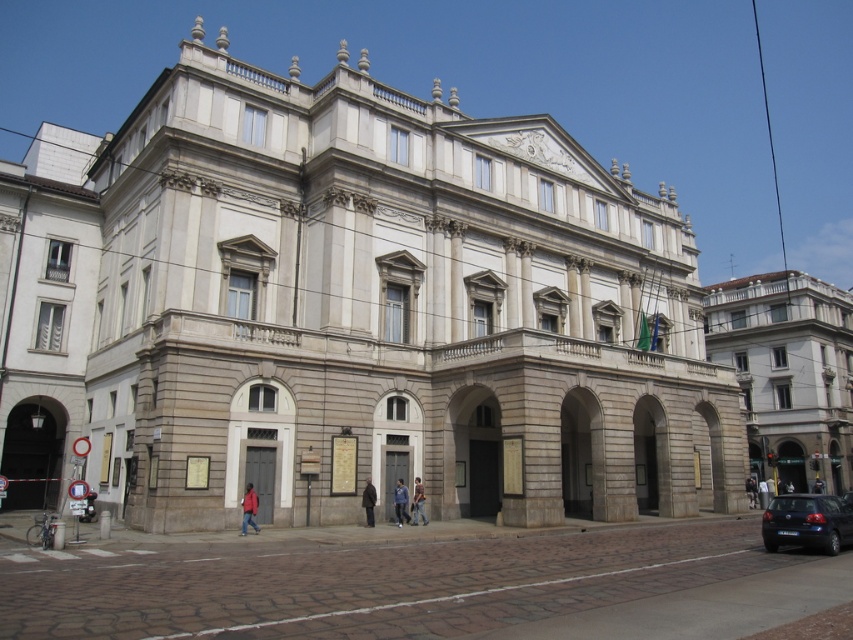
Question: Is dark gray coat at center smaller than dark blue jacket at center?

Choices:
 (A) no
 (B) yes

Answer: (B)

Question: Is blue denim jeans at center to the left of dark blue fabric jacket at center from the viewer's perspective?

Choices:
 (A) no
 (B) yes

Answer: (B)

Question: Which of the following is the farthest from the observer?

Choices:
 (A) blue denim jeans at center
 (B) red jacket at lower left
 (C) dark blue jacket at center
 (D) white fabric shirt at center

Answer: (D)

Question: Among these objects, which one is farthest from the camera?

Choices:
 (A) dark blue matte car at lower right
 (B) white fabric shirt at center
 (C) red jacket at lower left
 (D) dark blue jacket at center

Answer: (B)

Question: Which of these objects is positioned farthest from the dark blue matte car at lower right?

Choices:
 (A) denim jacket at center
 (B) white fabric shirt at center
 (C) dark blue fabric jacket at center

Answer: (B)

Question: Is dark blue jacket at center to the left of dark blue fabric jacket at center from the viewer's perspective?

Choices:
 (A) yes
 (B) no

Answer: (A)